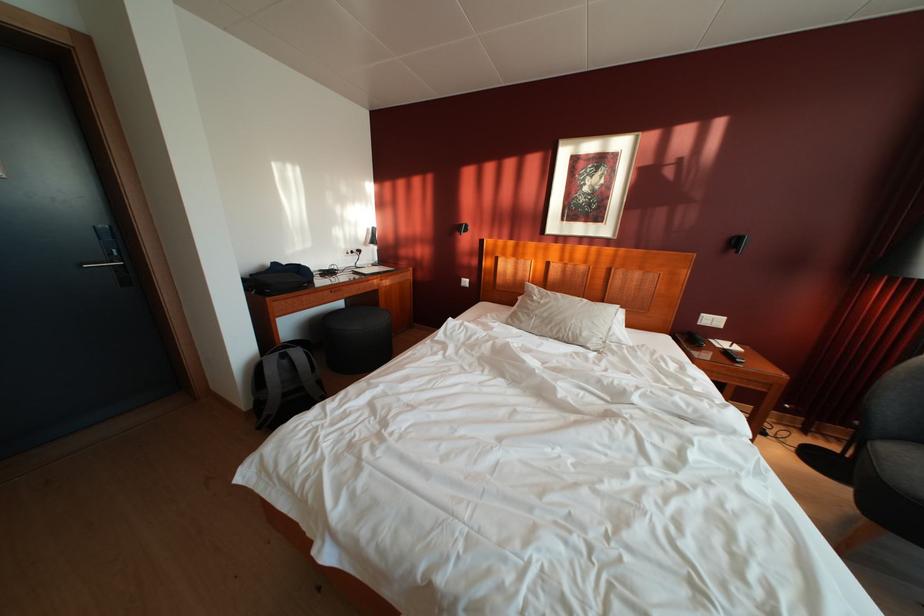
Find the location of a particular element. The width and height of the screenshot is (924, 616). chair sitting surface is located at coordinates (900, 466).